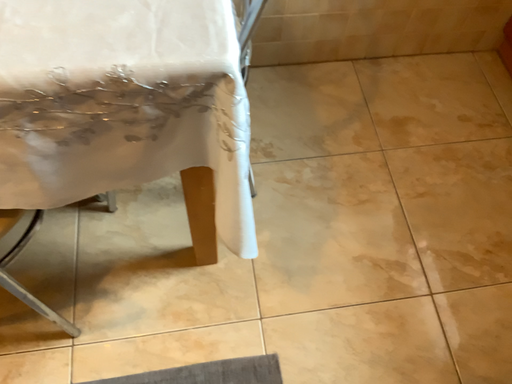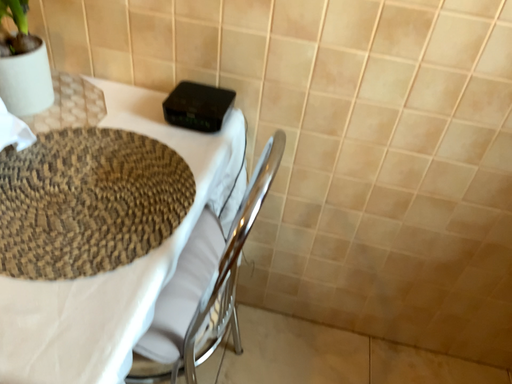
Question: How did the camera likely rotate when shooting the video?

Choices:
 (A) rotated left
 (B) rotated right

Answer: (A)